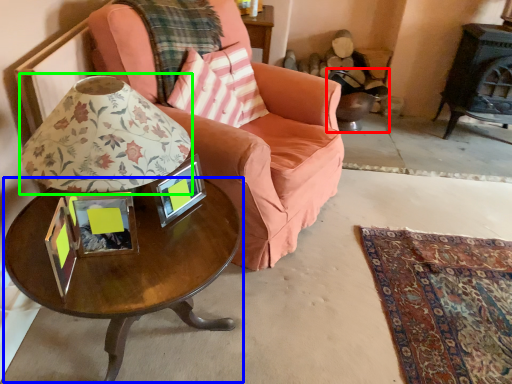
Question: Which object is positioned farthest from swivel chair (highlighted by a red box)? Select from coffee table (highlighted by a blue box) and table lamp (highlighted by a green box).

Choices:
 (A) coffee table
 (B) table lamp

Answer: (B)